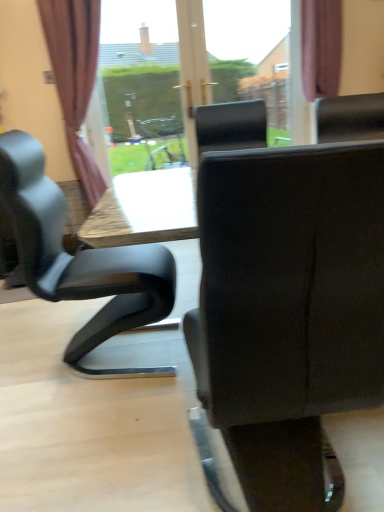
Question: Can you confirm if purple fabric curtain at upper right, which is the 2th curtain from left to right, is positioned to the left of brown fabric curtain at left, placed as the 2th curtain when sorted from right to left?

Choices:
 (A) no
 (B) yes

Answer: (A)

Question: From a real-world perspective, is purple fabric curtain at upper right, which is the 2th curtain from left to right, below brown fabric curtain at left, placed as the 2th curtain when sorted from right to left?

Choices:
 (A) yes
 (B) no

Answer: (B)

Question: Would you say brown fabric curtain at left, placed as the 2th curtain when sorted from right to left, is part of purple fabric curtain at upper right, which is the 2th curtain from left to right,'s contents?

Choices:
 (A) no
 (B) yes

Answer: (A)

Question: Can you confirm if purple fabric curtain at upper right, arranged as the 1th curtain when viewed from the right, is wider than brown fabric curtain at left, placed as the 2th curtain when sorted from right to left?

Choices:
 (A) no
 (B) yes

Answer: (A)

Question: Could you tell me if purple fabric curtain at upper right, arranged as the 1th curtain when viewed from the right, is turned towards brown fabric curtain at left, the 1th curtain from the left?

Choices:
 (A) no
 (B) yes

Answer: (A)

Question: Is brown fabric curtain at left, the 1th curtain from the left, taller or shorter than matte black chair at center?

Choices:
 (A) tall
 (B) short

Answer: (A)

Question: Does point (84, 150) appear closer or farther from the camera than point (377, 355)?

Choices:
 (A) farther
 (B) closer

Answer: (A)

Question: Looking at their shapes, would you say brown fabric curtain at left, the 1th curtain from the left, is wider or thinner than matte black chair at center?

Choices:
 (A) thin
 (B) wide

Answer: (A)

Question: Is brown fabric curtain at left, the 1th curtain from the left, situated inside matte black chair at center or outside?

Choices:
 (A) inside
 (B) outside

Answer: (B)

Question: Is purple fabric curtain at upper right, which is the 2th curtain from left to right, wider or thinner than matte black chair at center?

Choices:
 (A) thin
 (B) wide

Answer: (A)

Question: From the image's perspective, is purple fabric curtain at upper right, arranged as the 1th curtain when viewed from the right, above or below matte black chair at center?

Choices:
 (A) below
 (B) above

Answer: (B)

Question: From a real-world perspective, relative to matte black chair at center, is purple fabric curtain at upper right, which is the 2th curtain from left to right, vertically above or below?

Choices:
 (A) below
 (B) above

Answer: (B)

Question: Is point (332, 94) closer or farther from the camera than point (246, 438)?

Choices:
 (A) closer
 (B) farther

Answer: (B)

Question: In terms of size, does brown fabric curtain at left, the 1th curtain from the left, appear bigger or smaller than purple fabric curtain at upper right, arranged as the 1th curtain when viewed from the right?

Choices:
 (A) big
 (B) small

Answer: (A)

Question: Would you say brown fabric curtain at left, the 1th curtain from the left, is to the left or to the right of purple fabric curtain at upper right, which is the 2th curtain from left to right, in the picture?

Choices:
 (A) right
 (B) left

Answer: (B)